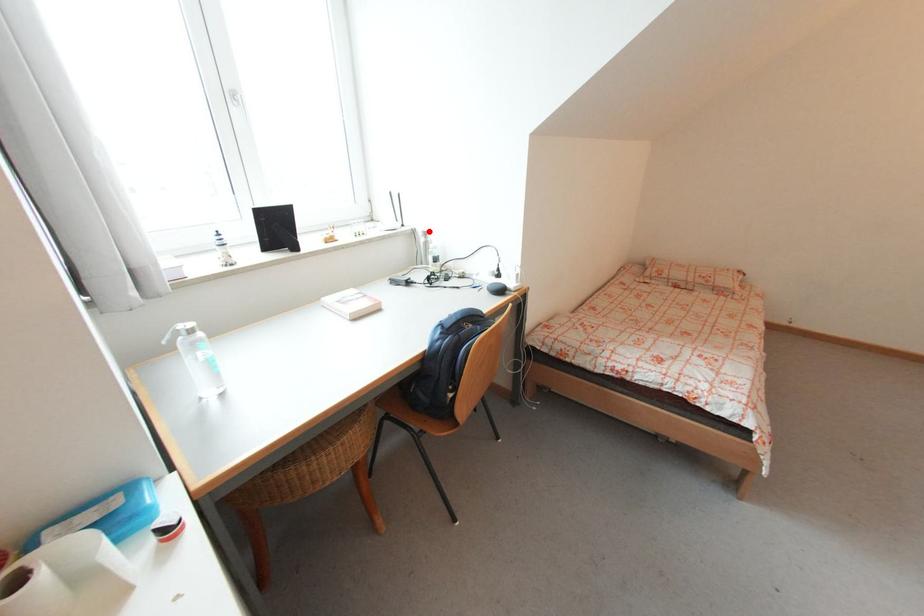
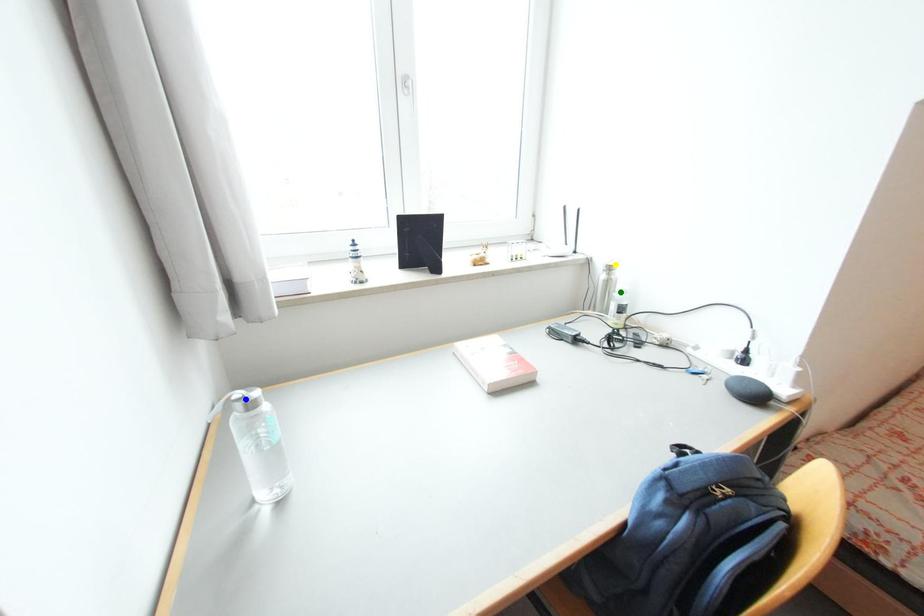
Question: I am providing you with two images of the same scene from different viewpoints. A red point is marked on the first image. You are given multiple points on the second image. Which mark in image 2 goes with the point in image 1?

Choices:
 (A) blue point
 (B) green point
 (C) yellow point

Answer: (C)